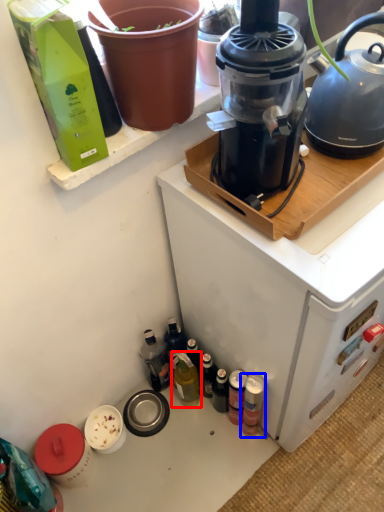
Question: Which object appears closest to the camera in this image, bottle (highlighted by a red box) or bottle (highlighted by a blue box)?

Choices:
 (A) bottle
 (B) bottle

Answer: (B)